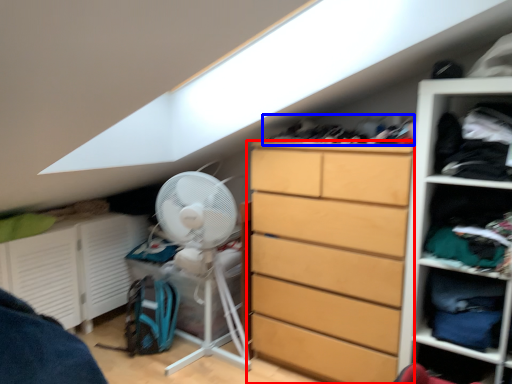
Question: Among these objects, which one is nearest to the camera, chest of drawers (highlighted by a red box) or laundry (highlighted by a blue box)?

Choices:
 (A) chest of drawers
 (B) laundry

Answer: (A)